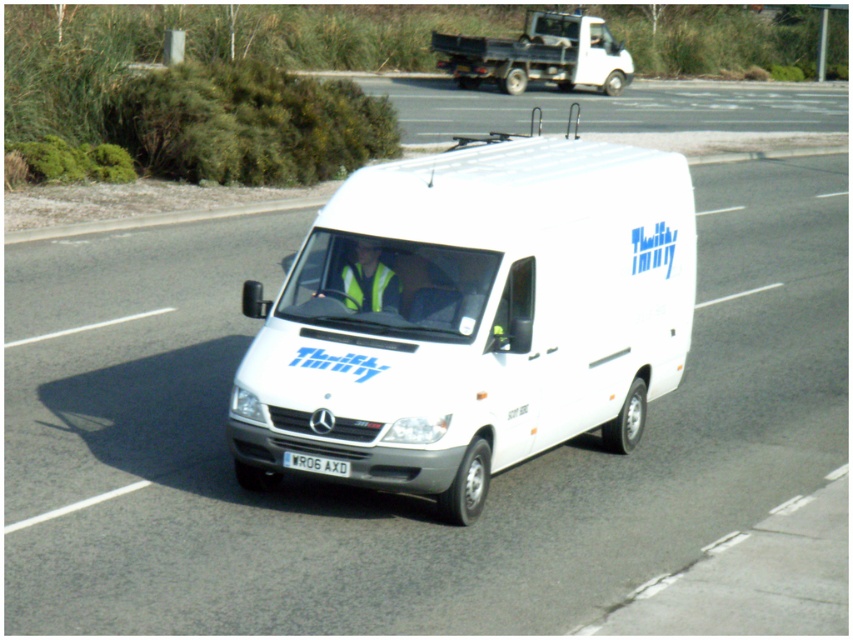
You are standing at the side of the road and see the white matte van at center. There is a point marked at coordinates (471, 316). Where is this point located?

The point is located on the white matte van at center.

You are a traffic officer observing a white matte truck at upper center and a white plastic license plate at center on the road. Which object is bigger in size?

The white matte truck at upper center has a larger size compared to the white plastic license plate at center.

What is the color and type of the vehicle located at the point marked by coordinates [538,54] in the image?

The point marked by coordinates [538,54] corresponds to the white matte truck at upper center.